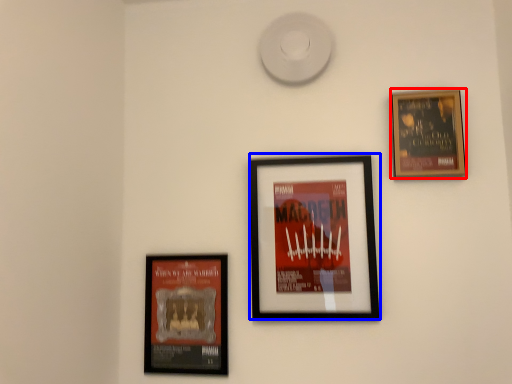
Question: Which of the following is the closest to the observer, picture frame (highlighted by a red box) or picture frame (highlighted by a blue box)?

Choices:
 (A) picture frame
 (B) picture frame

Answer: (B)